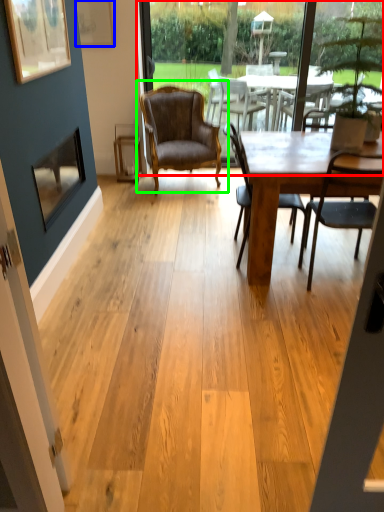
Question: Which is nearer to the window screen (highlighted by a red box)? picture frame (highlighted by a blue box) or chair (highlighted by a green box).

Choices:
 (A) picture frame
 (B) chair

Answer: (B)